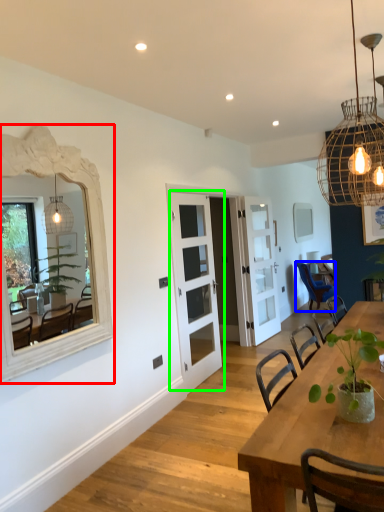
Question: Based on their relative distances, which object is farther from mirror (highlighted by a red box)? Choose from chair (highlighted by a blue box) and door (highlighted by a green box).

Choices:
 (A) chair
 (B) door

Answer: (A)